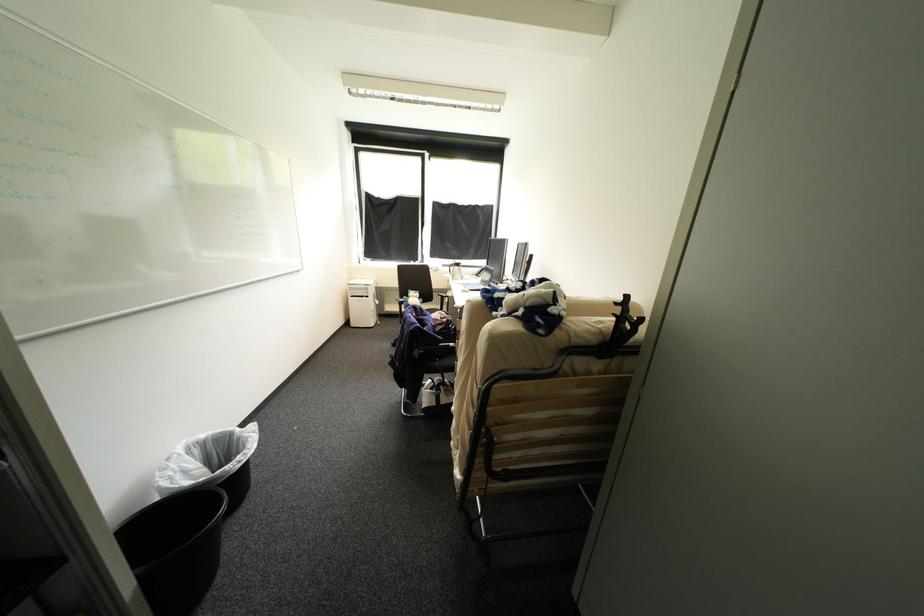
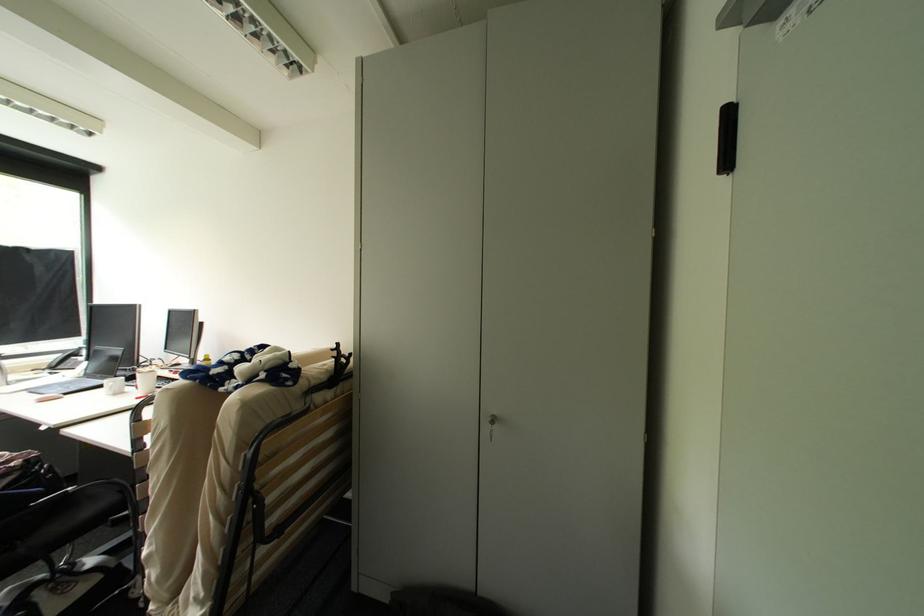
Where in the second image is the point corresponding to pixel 621 325 from the first image?

(341, 363)